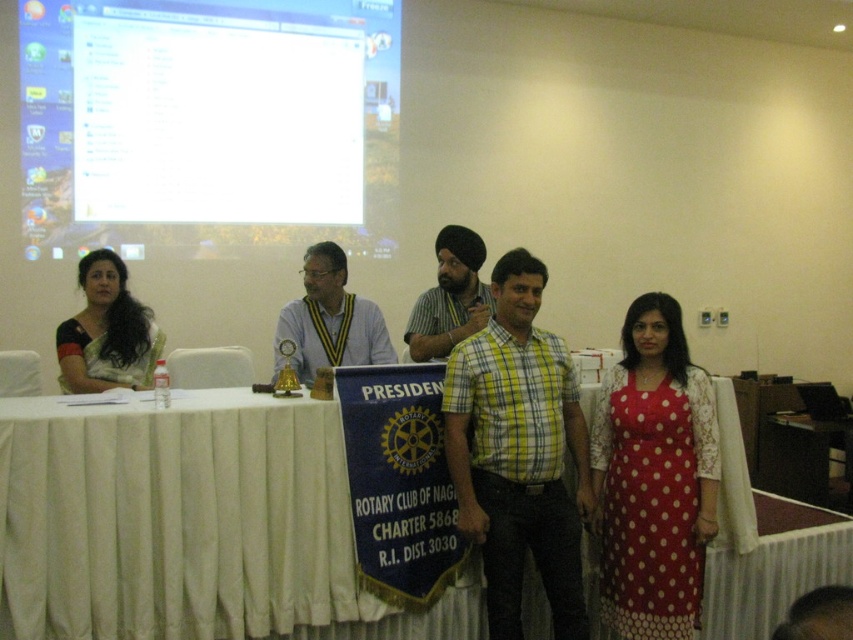
Question: Which object is the farthest from the white glossy screen at upper left?

Choices:
 (A) white cloth at center
 (B) yellow-green plaid shirt at center
 (C) sari at left

Answer: (B)

Question: Based on their relative distances, which object is farther from the matte yellow and black striped tie at center?

Choices:
 (A) white cloth at center
 (B) yellow-green plaid shirt at center

Answer: (B)

Question: Does white glossy screen at upper left have a smaller size compared to matte yellow and black striped tie at center?

Choices:
 (A) no
 (B) yes

Answer: (A)

Question: Is matte yellow and black striped tie at center positioned behind matte green shirt at center?

Choices:
 (A) no
 (B) yes

Answer: (A)

Question: From the image, what is the correct spatial relationship of white glossy screen at upper left in relation to matte green shirt at center?

Choices:
 (A) above
 (B) below

Answer: (A)

Question: Which point is closer to the camera?

Choices:
 (A) click(x=665, y=339)
 (B) click(x=486, y=579)
 (C) click(x=334, y=328)
 (D) click(x=453, y=339)

Answer: (B)